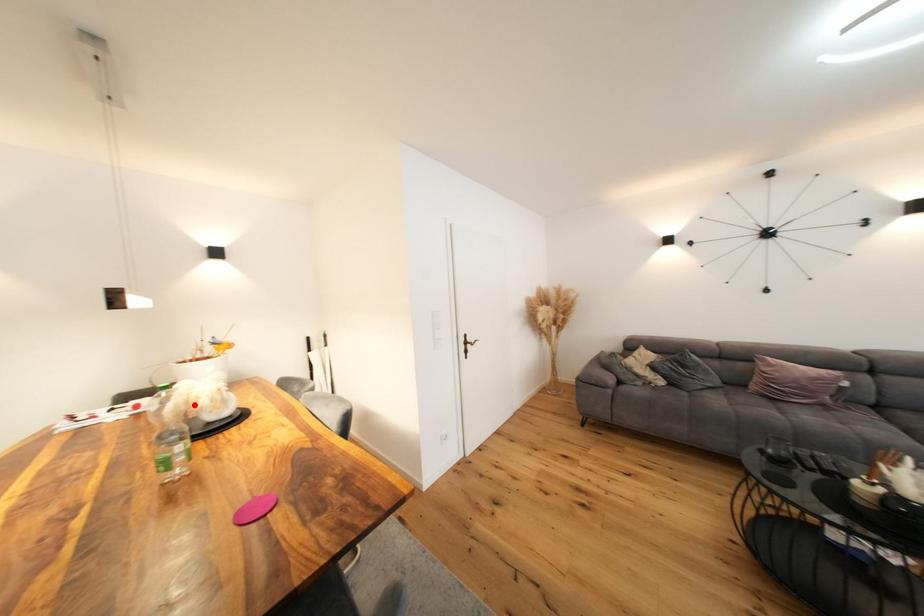
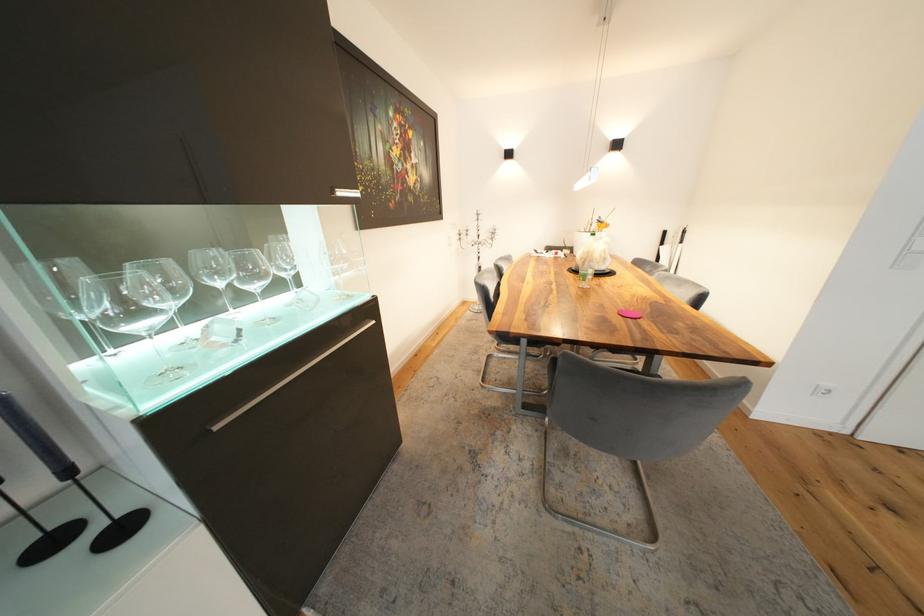
The point at the highlighted location is marked in the first image. Where is the corresponding point in the second image?

(594, 254)